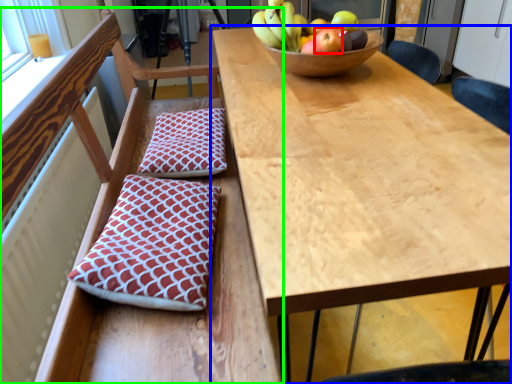
Question: Considering the real-world distances, which object is farthest from apple (highlighted by a red box)? table (highlighted by a blue box) or chair (highlighted by a green box)?

Choices:
 (A) table
 (B) chair

Answer: (B)